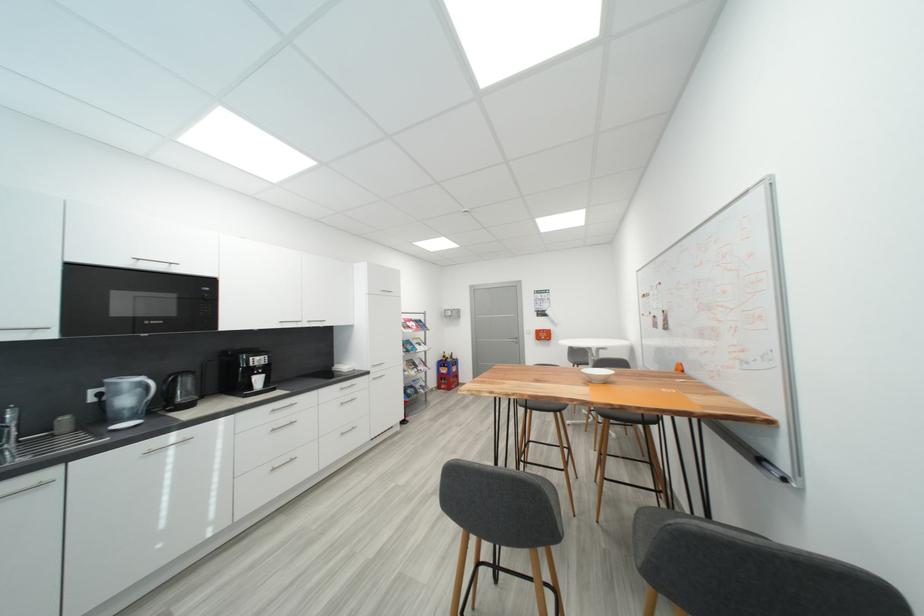
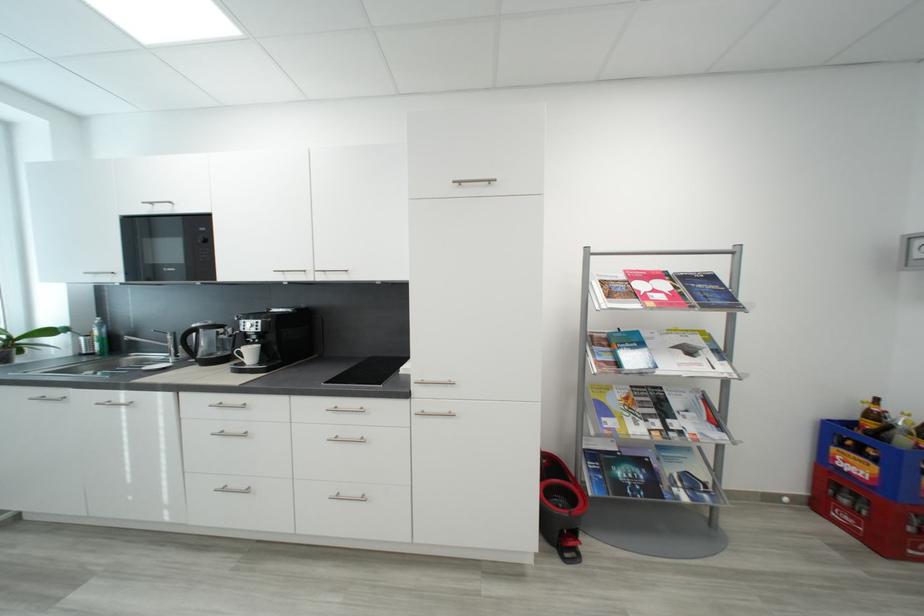
Locate, in the second image, the point that corresponds to the point at 428,323 in the first image.

(718, 280)